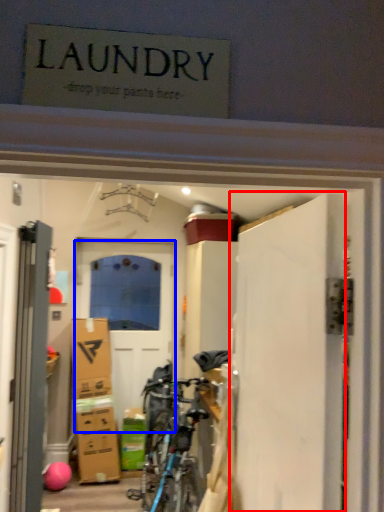
Question: Which object appears farthest to the camera in this image, door (highlighted by a red box) or door (highlighted by a blue box)?

Choices:
 (A) door
 (B) door

Answer: (B)